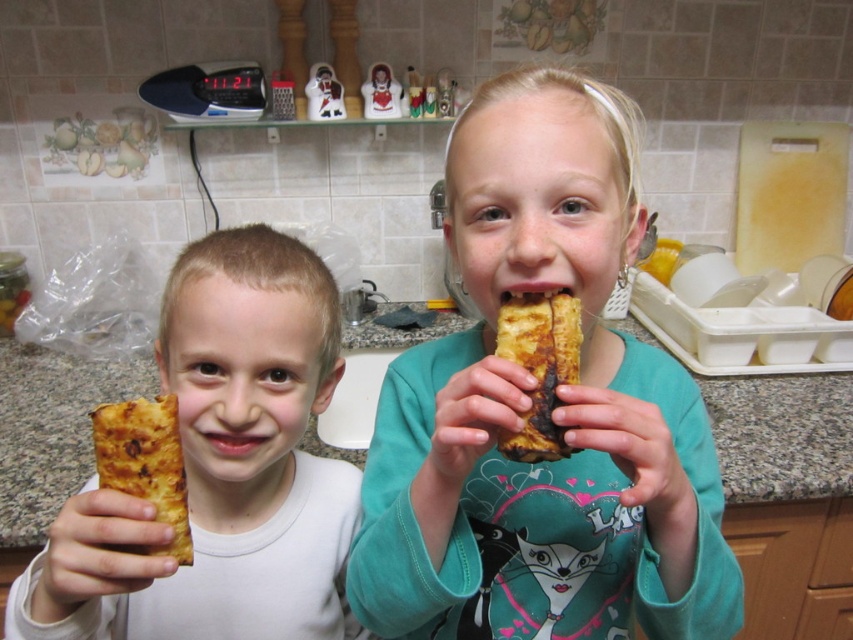
You are a chef preparing a dish and need to place the matte golden bread at center on the granite countertop at center. Based on their sizes, will the bread fit entirely on the countertop without overhanging?

The matte golden bread at center has a lesser width compared to granite countertop at center, so yes, the bread will fit entirely on the countertop without overhanging.

You are standing in the kitchen and see two points marked in the image. Which point is closer to you, point (473,365) or point (498,448)?

Point (473,365) is in front of point (498,448), so it is closer to you.